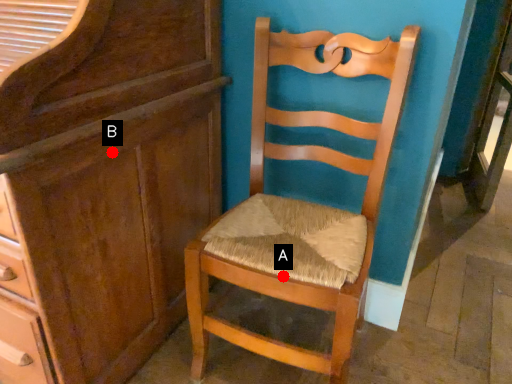
Question: Two points are circled on the image, labeled by A and B beside each circle. Which of the following is the farthest from the observer?

Choices:
 (A) A is further
 (B) B is further

Answer: (B)